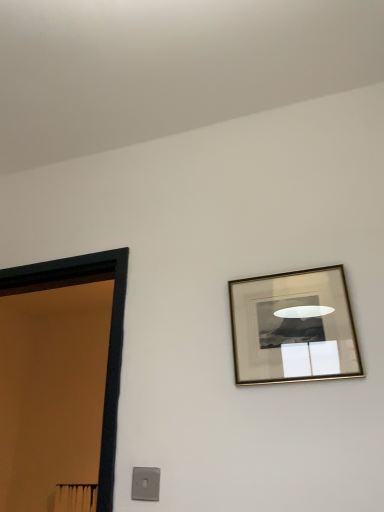
Question: Should I look upward or downward to see gold metallic picture frame at upper right?

Choices:
 (A) down
 (B) up

Answer: (A)

Question: Is satin silver switch at lower left wider than gold metallic picture frame at upper right?

Choices:
 (A) no
 (B) yes

Answer: (A)

Question: Would you say gold metallic picture frame at upper right is part of satin silver switch at lower left's contents?

Choices:
 (A) no
 (B) yes

Answer: (A)

Question: Is satin silver switch at lower left oriented away from gold metallic picture frame at upper right?

Choices:
 (A) no
 (B) yes

Answer: (A)

Question: Can you confirm if satin silver switch at lower left is positioned to the right of gold metallic picture frame at upper right?

Choices:
 (A) yes
 (B) no

Answer: (B)

Question: From the image's perspective, does satin silver switch at lower left appear lower than gold metallic picture frame at upper right?

Choices:
 (A) yes
 (B) no

Answer: (A)

Question: Does satin silver switch at lower left have a larger size compared to gold metallic picture frame at upper right?

Choices:
 (A) no
 (B) yes

Answer: (A)

Question: Does satin silver switch at lower left lie in front of black wooden door at left?

Choices:
 (A) no
 (B) yes

Answer: (B)

Question: From the image's perspective, is satin silver switch at lower left below black wooden door at left?

Choices:
 (A) yes
 (B) no

Answer: (A)

Question: Is satin silver switch at lower left positioned with its back to black wooden door at left?

Choices:
 (A) no
 (B) yes

Answer: (A)

Question: Can you confirm if satin silver switch at lower left is thinner than black wooden door at left?

Choices:
 (A) no
 (B) yes

Answer: (B)

Question: Does satin silver switch at lower left have a greater height compared to black wooden door at left?

Choices:
 (A) no
 (B) yes

Answer: (A)

Question: Would you consider satin silver switch at lower left to be distant from black wooden door at left?

Choices:
 (A) yes
 (B) no

Answer: (B)

Question: Considering the relative sizes of black wooden door at left and satin silver switch at lower left in the image provided, is black wooden door at left thinner than satin silver switch at lower left?

Choices:
 (A) no
 (B) yes

Answer: (A)